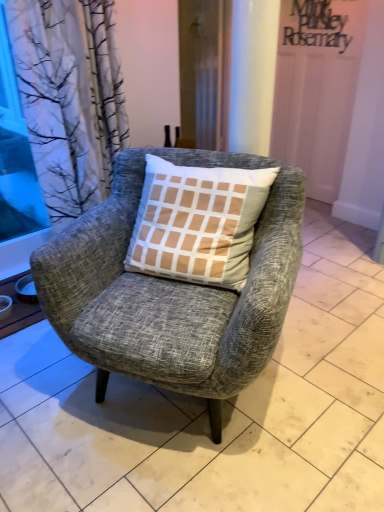
Question: Is textured gray armchair at center turned away from wooden screen door at center?

Choices:
 (A) no
 (B) yes

Answer: (B)

Question: Is textured gray armchair at center bigger than wooden screen door at center?

Choices:
 (A) no
 (B) yes

Answer: (B)

Question: Is textured gray armchair at center at the right side of wooden screen door at center?

Choices:
 (A) yes
 (B) no

Answer: (B)

Question: From a real-world perspective, is textured gray armchair at center on wooden screen door at center?

Choices:
 (A) no
 (B) yes

Answer: (A)

Question: Considering the relative positions of textured gray armchair at center and wooden screen door at center in the image provided, is textured gray armchair at center to the left of wooden screen door at center from the viewer's perspective?

Choices:
 (A) no
 (B) yes

Answer: (B)

Question: Is matte wood window sill at lower left inside the boundaries of textured gray armchair at center, or outside?

Choices:
 (A) inside
 (B) outside

Answer: (B)

Question: Is matte wood window sill at lower left taller or shorter than textured gray armchair at center?

Choices:
 (A) short
 (B) tall

Answer: (A)

Question: Considering the positions of matte wood window sill at lower left and textured gray armchair at center in the image, is matte wood window sill at lower left wider or thinner than textured gray armchair at center?

Choices:
 (A) thin
 (B) wide

Answer: (A)

Question: Is matte wood window sill at lower left to the left or to the right of textured gray armchair at center in the image?

Choices:
 (A) right
 (B) left

Answer: (B)

Question: From a real-world perspective, is transparent glass window screen at left positioned above or below wooden screen door at center?

Choices:
 (A) above
 (B) below

Answer: (B)

Question: From the image's perspective, is transparent glass window screen at left located above or below wooden screen door at center?

Choices:
 (A) below
 (B) above

Answer: (A)

Question: Is transparent glass window screen at left to the left or to the right of wooden screen door at center in the image?

Choices:
 (A) left
 (B) right

Answer: (A)

Question: Considering the positions of transparent glass window screen at left and wooden screen door at center in the image, is transparent glass window screen at left bigger or smaller than wooden screen door at center?

Choices:
 (A) small
 (B) big

Answer: (A)

Question: In terms of size, does wooden screen door at center appear bigger or smaller than matte wood window sill at lower left?

Choices:
 (A) small
 (B) big

Answer: (B)

Question: From the image's perspective, relative to matte wood window sill at lower left, is wooden screen door at center above or below?

Choices:
 (A) above
 (B) below

Answer: (A)